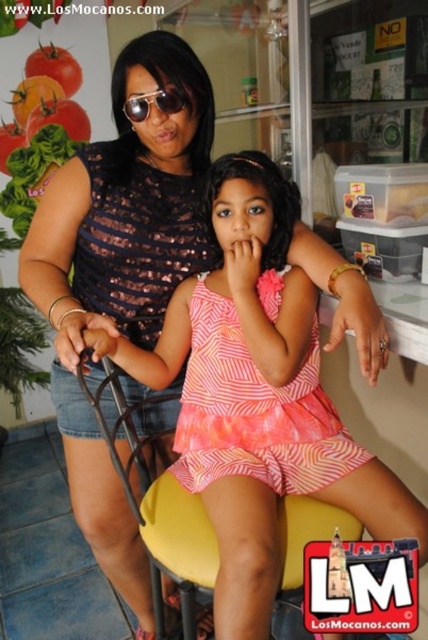
You are trying to decide whether to place a new accessory on the yellow fabric chair at center or the shiny metallic sunglasses at center. Based on their sizes, which object would be more suitable for placing a medium sized accessory?

The yellow fabric chair at center is larger in size than the shiny metallic sunglasses at center, so the yellow fabric chair at center would be more suitable for placing a medium sized accessory.

You are standing in the cafe and want to place a small table exactly at point (294, 483). The table has a diameter of 0.8 meters. Is there enough space around the point to fit the table without touching any nearby objects?

The distance between the viewer and point (294, 483) is 1.08 meters. Since the table requires 0.8 meters of space, there is sufficient room around the point to place the table without touching nearby objects.